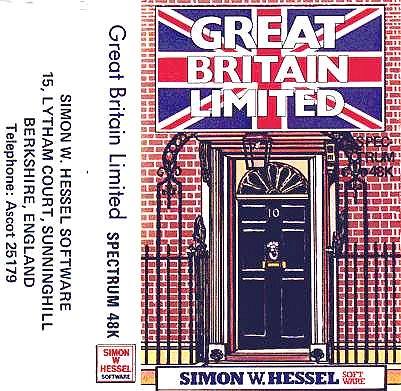
Image resolution: width=401 pixels, height=391 pixels. Find the location of `brick wall`. brick wall is located at coordinates (188, 229), (383, 238).